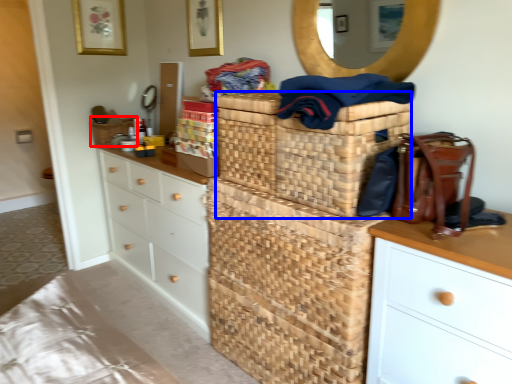
Question: Which point is closer to the camera, basket (highlighted by a red box) or basket (highlighted by a blue box)?

Choices:
 (A) basket
 (B) basket

Answer: (B)